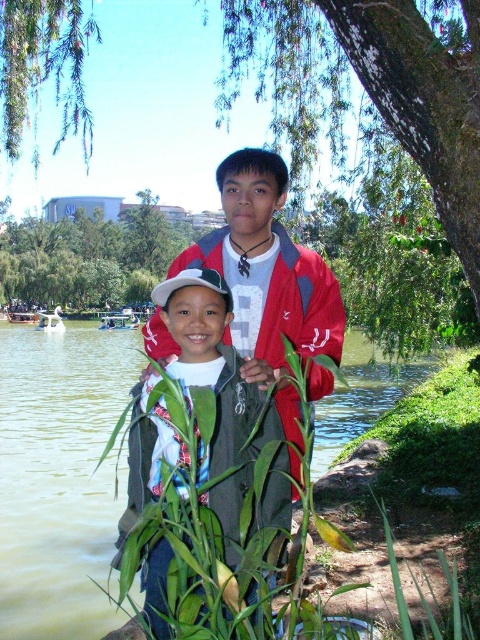
You are a drone operator trying to locate a specific point in an image. The point is at coordinates point (216, 392). Which object in the image is this point located on?

The point (216, 392) is located on the green fabric jacket at center.

You are planning to take a photo of the green leafy tree at center and the green leafy branches at upper left. Which one should you focus on if you want to capture the wider subject?

The green leafy tree at center should be focused on because its width is larger than the green leafy branches at upper left.

You are a photographer trying to capture a clear shot of the child in the scene. The green fabric jacket at center and the green leafy tree at center might interfere with the composition. Which object is closer to the child to ensure the focus is on them?

The green fabric jacket at center is positioned under the green leafy tree at center, so the jacket is closer to the child and would be the object to focus on.